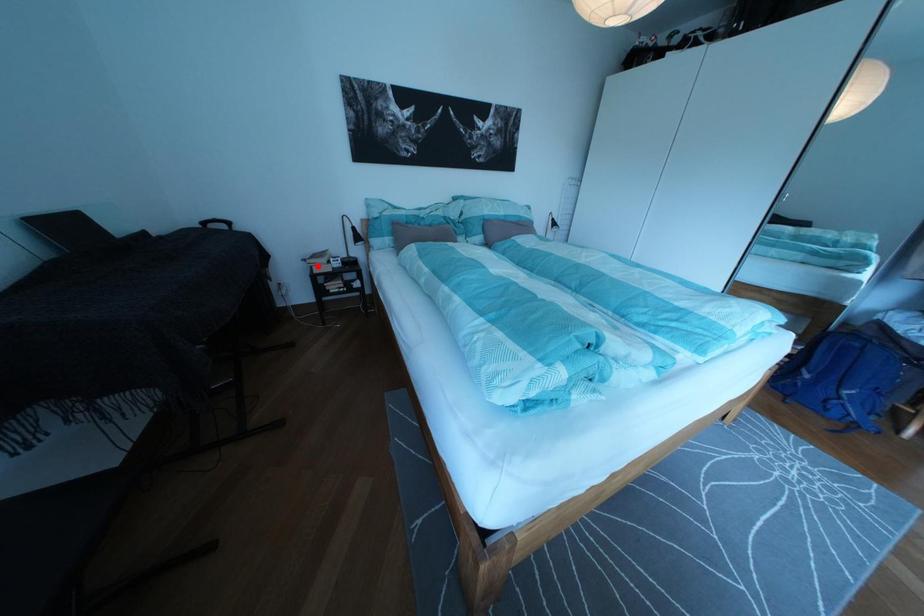
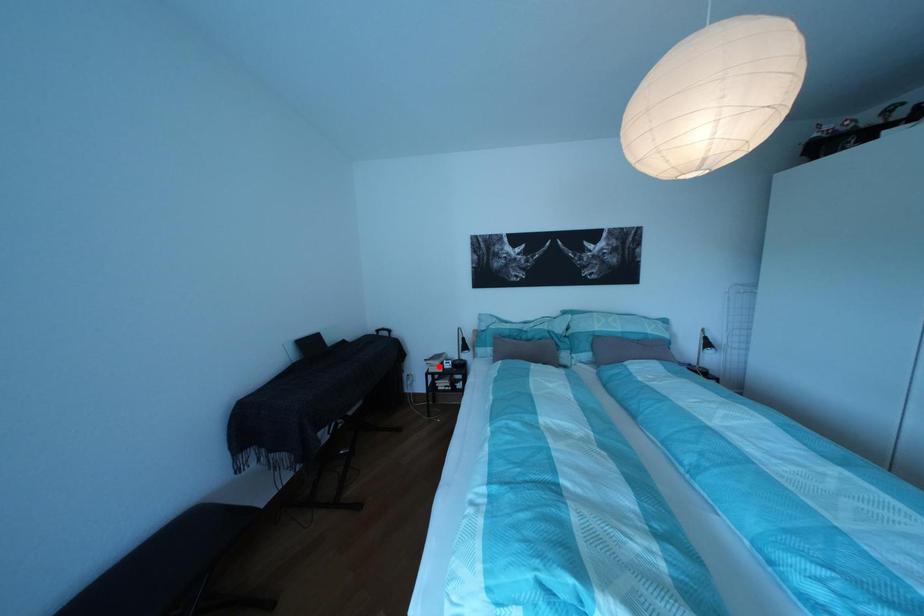
I am providing you with two images of the same scene from different viewpoints. A red point is marked on the first image and another point is marked on the second image. Is the red point in image1 aligned with the point shown in image2?

Yes